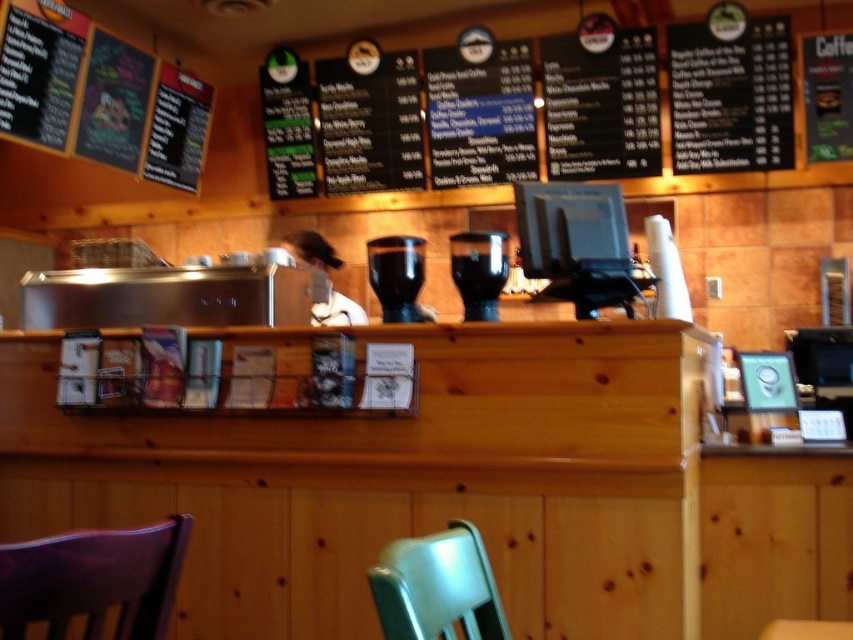
Question: Does metallic green chair at lower center come behind white fabric shirt at center?

Choices:
 (A) yes
 (B) no

Answer: (B)

Question: Can you confirm if black matte coffee machine at center is wider than white fabric shirt at center?

Choices:
 (A) yes
 (B) no

Answer: (B)

Question: Which point is farther from the camera taking this photo?

Choices:
 (A) (494, 269)
 (B) (387, 545)

Answer: (A)

Question: Is purple leather chair at lower left bigger than metallic green chair at lower center?

Choices:
 (A) no
 (B) yes

Answer: (A)

Question: Which of these objects is positioned farthest from the metallic green chair at lower center?

Choices:
 (A) black matte coffee machine at center
 (B) black glass coffee machine at center

Answer: (A)

Question: Estimate the real-world distances between objects in this image. Which object is farther from the purple leather chair at lower left?

Choices:
 (A) black matte coffee machine at center
 (B) black glass coffee machine at center
 (C) white fabric shirt at center
 (D) metallic green chair at lower center

Answer: (C)